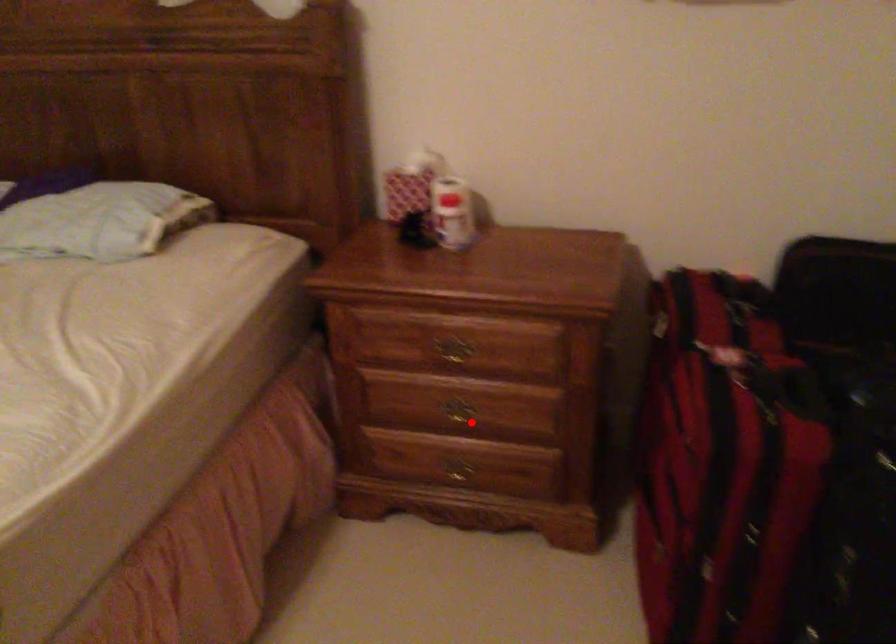
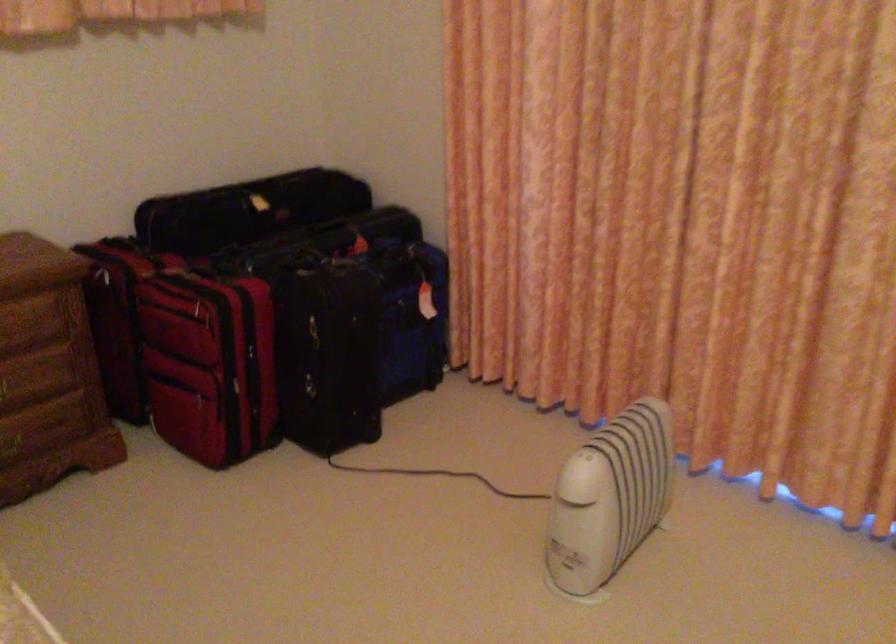
Find the pixel in the second image that matches the highlighted location in the first image.

(18, 391)